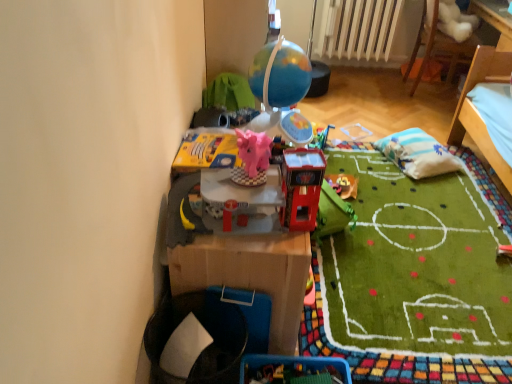
Question: Is the position of shiny plastic toy at center, which appears as the first toy when viewed from the right, less distant than that of striped fabric pillow at center right?

Choices:
 (A) yes
 (B) no

Answer: (A)

Question: Can you confirm if shiny plastic toy at center, the third toy when ordered from left to right, is positioned to the right of striped fabric pillow at center right?

Choices:
 (A) yes
 (B) no

Answer: (B)

Question: Considering the relative sizes of shiny plastic toy at center, which appears as the first toy when viewed from the right, and striped fabric pillow at center right in the image provided, is shiny plastic toy at center, which appears as the first toy when viewed from the right, bigger than striped fabric pillow at center right?

Choices:
 (A) no
 (B) yes

Answer: (A)

Question: Could you tell me if shiny plastic toy at center, the third toy when ordered from left to right, is turned towards striped fabric pillow at center right?

Choices:
 (A) yes
 (B) no

Answer: (B)

Question: From a real-world perspective, is shiny plastic toy at center, placed as the 1th toy when sorted from back to front, positioned under striped fabric pillow at center right based on gravity?

Choices:
 (A) yes
 (B) no

Answer: (A)

Question: From a real-world perspective, is matte pink elephant at center, the first toy viewed from the left, positioned above or below shiny plastic toy at center, the third toy when ordered from left to right?

Choices:
 (A) above
 (B) below

Answer: (A)

Question: Looking at their shapes, would you say matte pink elephant at center, arranged as the 3th toy when viewed from the right, is wider or thinner than shiny plastic toy at center, which appears as the first toy when viewed from the right?

Choices:
 (A) thin
 (B) wide

Answer: (A)

Question: In the image, is matte pink elephant at center, arranged as the 3th toy when viewed from the right, on the left side or the right side of shiny plastic toy at center, arranged as the third toy when viewed from the front?

Choices:
 (A) right
 (B) left

Answer: (B)

Question: Considering their positions, is matte pink elephant at center, the second toy in the front-to-back sequence, located in front of or behind shiny plastic toy at center, placed as the 1th toy when sorted from back to front?

Choices:
 (A) front
 (B) behind

Answer: (A)

Question: Does point (343, 187) appear closer or farther from the camera than point (263, 137)?

Choices:
 (A) closer
 (B) farther

Answer: (B)

Question: Considering their positions, is shiny plastic toy at center, the third toy when ordered from left to right, located in front of or behind matte pink elephant at center, the first toy viewed from the left?

Choices:
 (A) behind
 (B) front

Answer: (A)

Question: From the image's perspective, relative to matte pink elephant at center, the second toy in the front-to-back sequence, is shiny plastic toy at center, placed as the 1th toy when sorted from back to front, above or below?

Choices:
 (A) below
 (B) above

Answer: (A)

Question: From a real-world perspective, is shiny plastic toy at center, the third toy when ordered from left to right, above or below matte pink elephant at center, the first toy viewed from the left?

Choices:
 (A) below
 (B) above

Answer: (A)

Question: Is striped fabric pillow at center right to the left or to the right of shiny plastic toy at center, arranged as the third toy when viewed from the front, in the image?

Choices:
 (A) left
 (B) right

Answer: (B)

Question: Considering the positions of striped fabric pillow at center right and shiny plastic toy at center, arranged as the third toy when viewed from the front, in the image, is striped fabric pillow at center right taller or shorter than shiny plastic toy at center, arranged as the third toy when viewed from the front,?

Choices:
 (A) tall
 (B) short

Answer: (A)